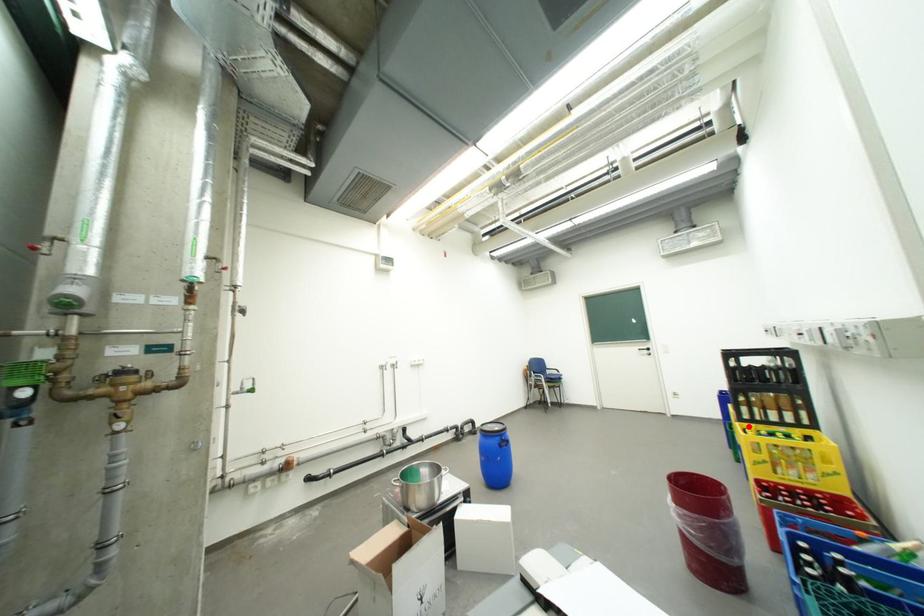
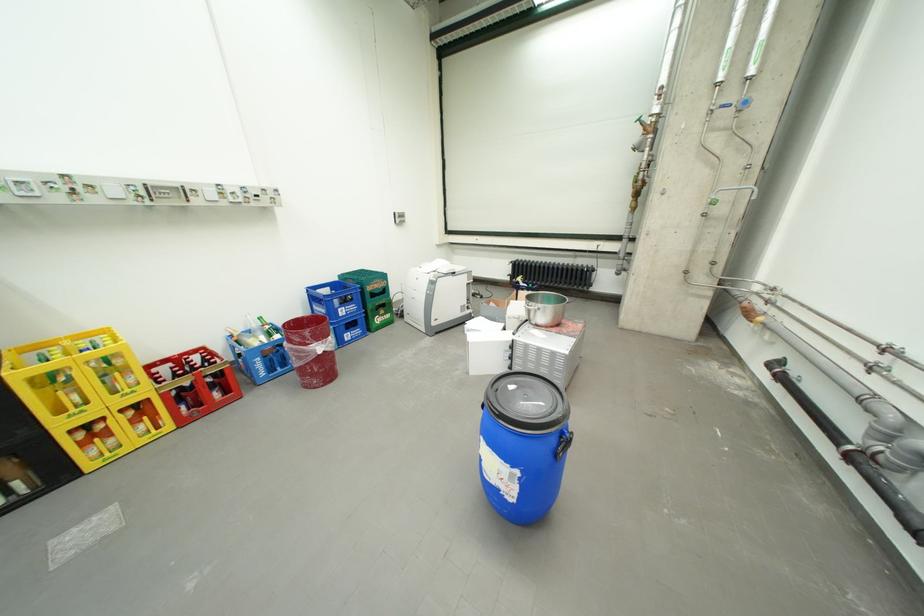
Find the pixel in the second image that matches the highlighted location in the first image.

(30, 374)